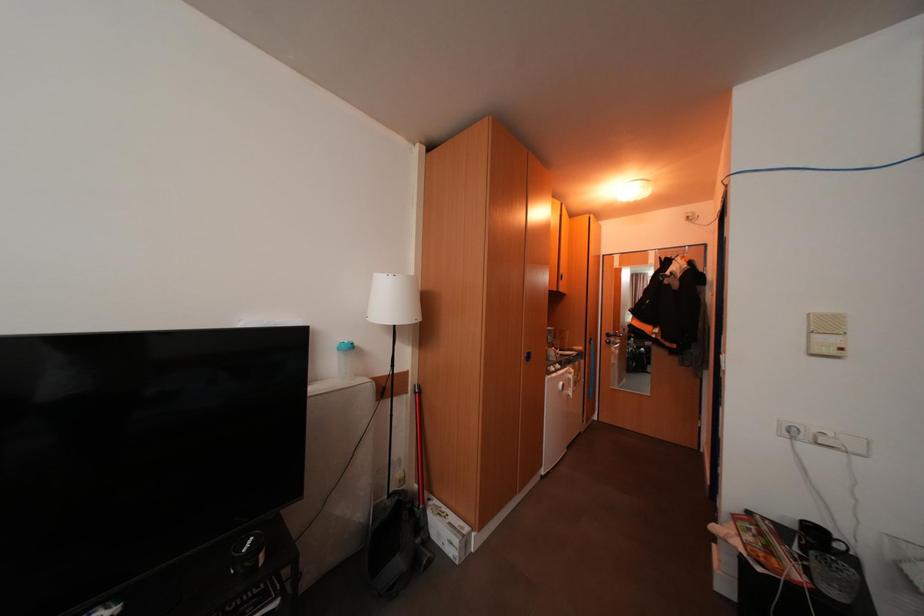
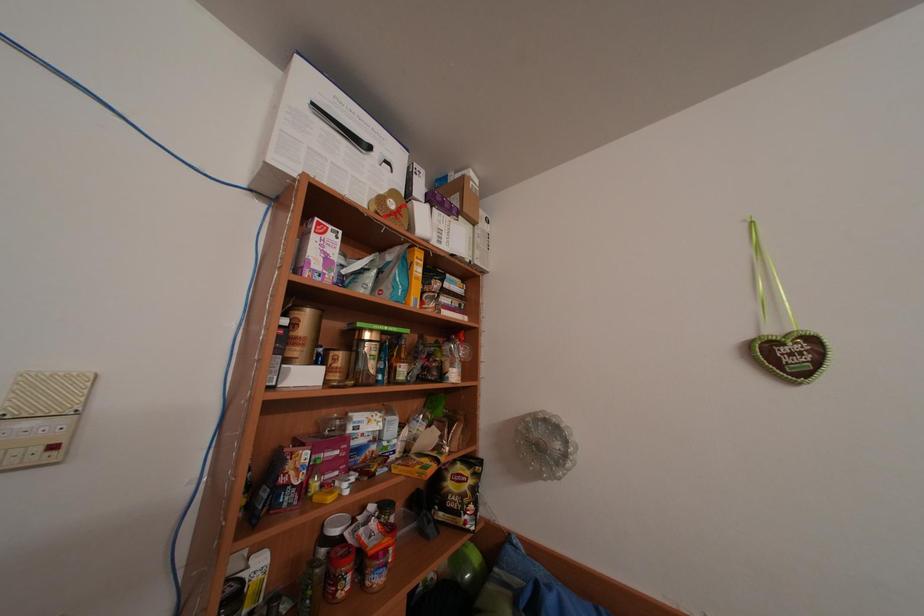
Question: Based on the continuous images, in which direction is the camera rotating? Reply with the corresponding letter.

Choices:
 (A) Left
 (B) Right
 (C) Up
 (D) Down

Answer: (B)